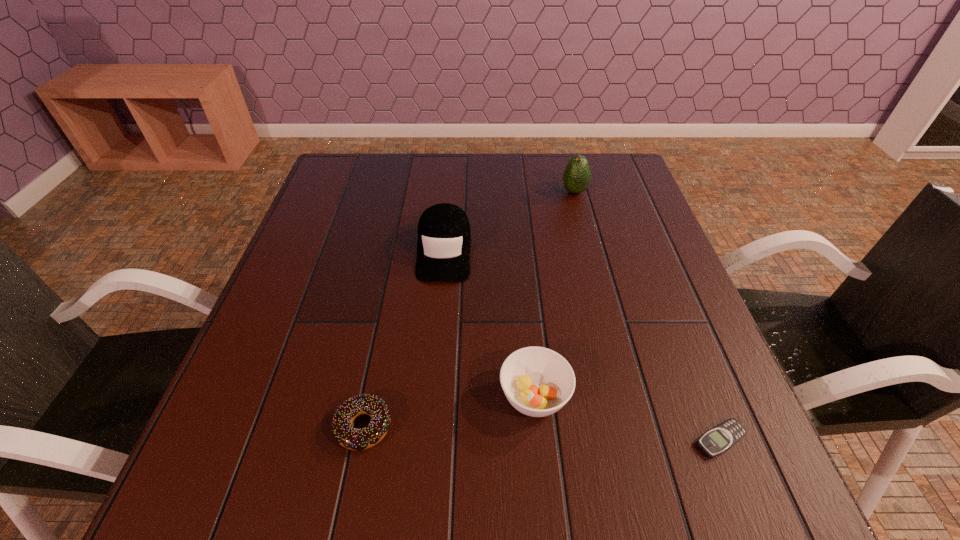
The image size is (960, 540). Find the location of `vacant area that lies between the beeper and the fourth tallest object`. vacant area that lies between the beeper and the fourth tallest object is located at coordinates point(542,433).

You are a GUI agent. You are given a task and a screenshot of the screen. Output one action in this format:
    pyautogui.click(x=<x>, y=<y>)
    Task: Click on the vacant area that lies between the doughnut and the beeper
    This screenshot has height=540, width=960.
    Given the screenshot: What is the action you would take?
    (542, 433)

Find the location of a particular element. The height and width of the screenshot is (540, 960). free space between the soup bowl and the second shortest object is located at coordinates (449, 411).

You are a GUI agent. You are given a task and a screenshot of the screen. Output one action in this format:
    pyautogui.click(x=<x>, y=<y>)
    Task: Click on the free space between the doughnut and the farthest object
    This screenshot has width=960, height=540.
    Given the screenshot: What is the action you would take?
    pyautogui.click(x=469, y=309)

Where is `unoccupied area between the third shortest object and the beeper`? The width and height of the screenshot is (960, 540). unoccupied area between the third shortest object and the beeper is located at coordinates pyautogui.click(x=628, y=418).

Locate an element on the screen. This screenshot has height=540, width=960. free area in between the doughnut and the tallest object is located at coordinates (469, 309).

You are a GUI agent. You are given a task and a screenshot of the screen. Output one action in this format:
    pyautogui.click(x=<x>, y=<y>)
    Task: Click on the free spot between the second shortest object and the third tallest object
    
    Given the screenshot: What is the action you would take?
    pyautogui.click(x=449, y=411)

The width and height of the screenshot is (960, 540). Identify the location of object that is the third closest to the second farthest object. (346, 435).

You are a GUI agent. You are given a task and a screenshot of the screen. Output one action in this format:
    pyautogui.click(x=<x>, y=<y>)
    Task: Click on the object that is the second closest to the soup bowl
    Image resolution: width=960 pixels, height=540 pixels.
    Given the screenshot: What is the action you would take?
    pyautogui.click(x=720, y=438)

At what (x,y) coordinates should I click in order to perform the action: click on free point that satisfies the following two spatial constraints: 1. on the front side of the beeper; 2. on the left side of the fourth tallest object. Please return your answer as a coordinate pair (x, y). Looking at the image, I should click on (361, 440).